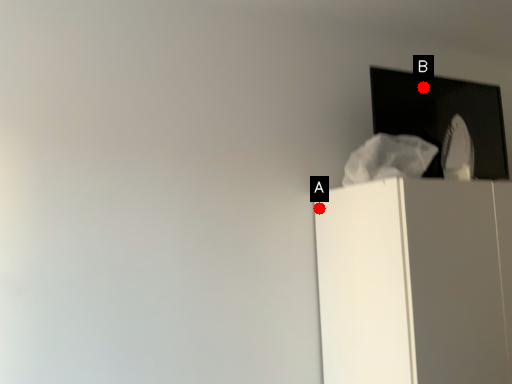
Question: Two points are circled on the image, labeled by A and B beside each circle. Which point is farther to the camera?

Choices:
 (A) A is further
 (B) B is further

Answer: (B)